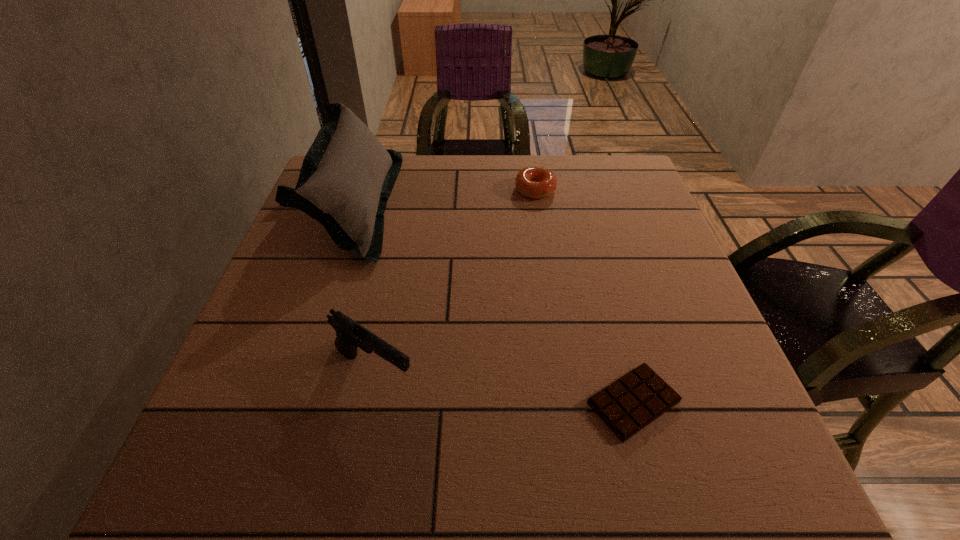
Locate an element on the screen. the closest object relative to the tallest object is located at coordinates (350, 335).

Point out which object is positioned as the nearest to the shortest object. Please provide its 2D coordinates. Your answer should be formatted as a tuple, i.e. [(x, y)], where the tuple contains the x and y coordinates of a point satisfying the conditions above.

[(350, 335)]

Where is `vacant space that satisfies the following two spatial constraints: 1. at the muzzle of the third shortest object; 2. on the left side of the shortest object`? vacant space that satisfies the following two spatial constraints: 1. at the muzzle of the third shortest object; 2. on the left side of the shortest object is located at coordinates (368, 402).

Image resolution: width=960 pixels, height=540 pixels. I want to click on vacant space that satisfies the following two spatial constraints: 1. on the back side of the shortest object; 2. on the surface of the tallest object, so click(x=580, y=205).

Locate an element on the screen. vacant point that satisfies the following two spatial constraints: 1. on the back side of the candy bar; 2. at the muzzle of the gun is located at coordinates (625, 372).

Image resolution: width=960 pixels, height=540 pixels. Identify the location of vacant area that satisfies the following two spatial constraints: 1. on the front side of the third tallest object; 2. on the right side of the candy bar. (569, 402).